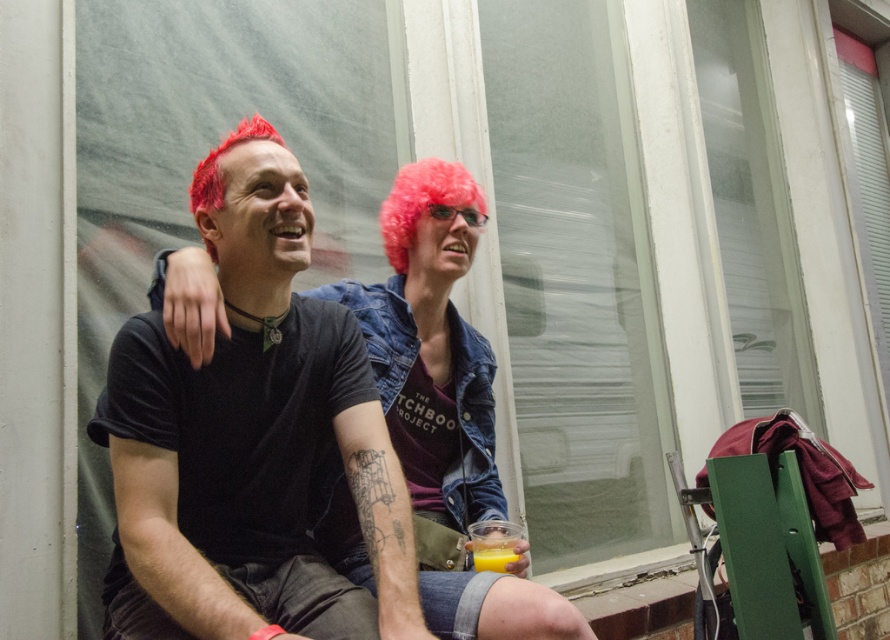
Question: Considering the real-world distances, which object is closest to the pink synthetic wig at upper center?

Choices:
 (A) black matte t-shirt at center
 (B) translucent plastic cup at lower center

Answer: (A)

Question: Among these points, which one is nearest to the camera?

Choices:
 (A) (403, 246)
 (B) (483, 548)
 (C) (308, 236)

Answer: (C)

Question: Does black matte t-shirt at center lie in front of pink synthetic wig at upper center?

Choices:
 (A) no
 (B) yes

Answer: (B)

Question: Is black matte t-shirt at center above translucent plastic cup at lower center?

Choices:
 (A) yes
 (B) no

Answer: (A)

Question: Which point is farther from the camera taking this photo?

Choices:
 (A) (243, 141)
 (B) (507, 561)

Answer: (B)

Question: Is pink synthetic wig at upper center smaller than translucent plastic cup at lower center?

Choices:
 (A) yes
 (B) no

Answer: (B)